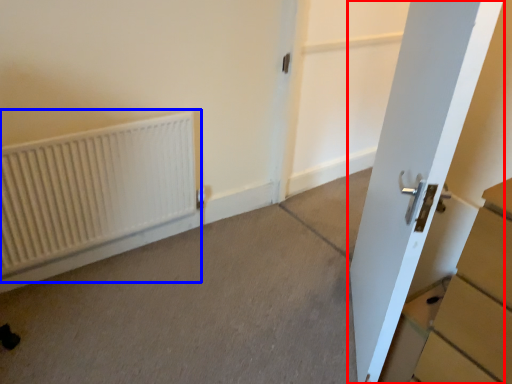
Question: Which point is further to the camera, door (highlighted by a red box) or radiator (highlighted by a blue box)?

Choices:
 (A) door
 (B) radiator

Answer: (B)